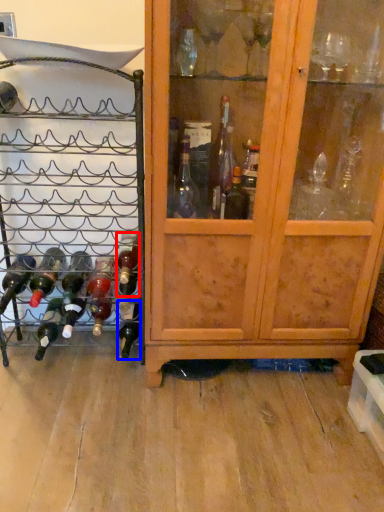
Question: Which of the following is the farthest to the observer, bottle (highlighted by a red box) or bottle (highlighted by a blue box)?

Choices:
 (A) bottle
 (B) bottle

Answer: (B)